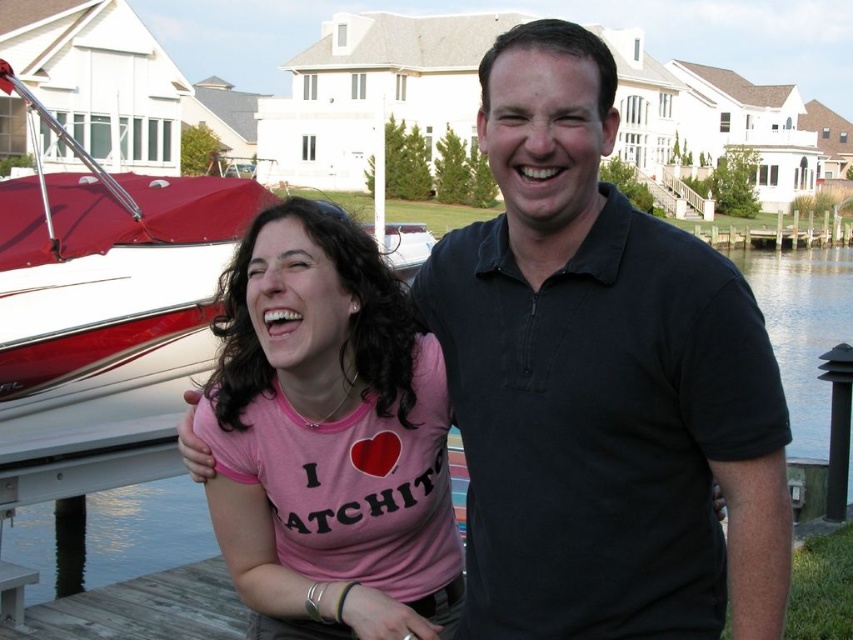
Question: Which point is farther from the camera taking this photo?

Choices:
 (A) (190, 513)
 (B) (807, 372)

Answer: (B)

Question: Among these objects, which one is farthest from the camera?

Choices:
 (A) pink cotton t-shirt at center
 (B) transparent water at dock lower
 (C) black cotton polo shirt at center
 (D) clear water at dock right

Answer: (D)

Question: Is transparent water at dock lower in front of clear water at dock right?

Choices:
 (A) yes
 (B) no

Answer: (A)

Question: Does transparent water at dock lower appear on the right side of clear water at dock right?

Choices:
 (A) yes
 (B) no

Answer: (B)

Question: In this image, where is black cotton polo shirt at center located relative to transparent water at dock lower?

Choices:
 (A) below
 (B) above

Answer: (B)

Question: Which point is closer to the camera?

Choices:
 (A) (109, 528)
 (B) (612, 552)
 (C) (844, 289)
 (D) (416, 497)

Answer: (B)